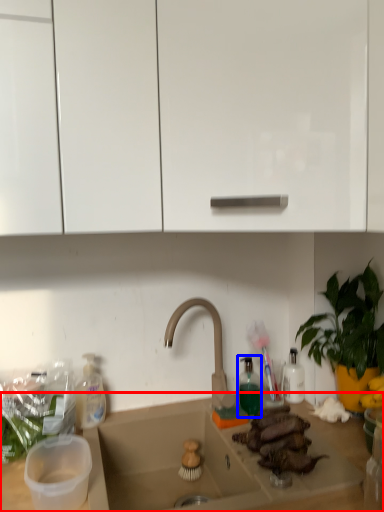
Question: Which object is closer to the camera taking this photo, countertop (highlighted by a red box) or bottle (highlighted by a blue box)?

Choices:
 (A) countertop
 (B) bottle

Answer: (A)